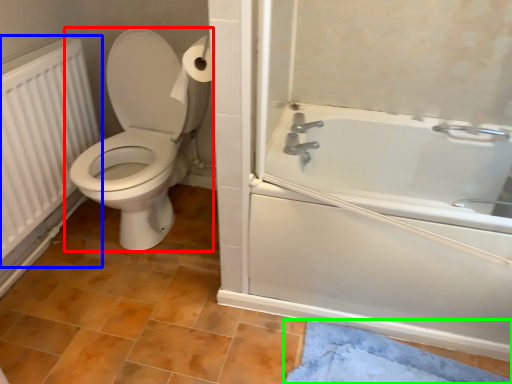
Question: Which is nearer to the toilet (highlighted by a red box)? radiator (highlighted by a blue box) or bath mat (highlighted by a green box).

Choices:
 (A) radiator
 (B) bath mat

Answer: (A)